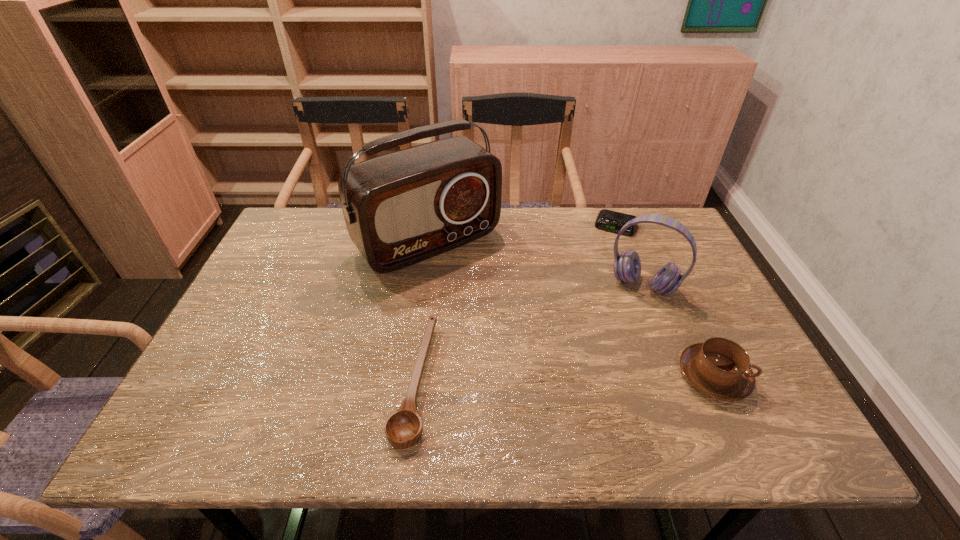
Choose which object is the second nearest neighbor to the second tallest object. Please provide its 2D coordinates. Your answer should be formatted as a tuple, i.e. [(x, y)], where the tuple contains the x and y coordinates of a point satisfying the conditions above.

[(719, 368)]

Where is `the closest object to the tallest object`? The image size is (960, 540). the closest object to the tallest object is located at coordinates (403, 428).

Identify the location of free space that satisfies the following two spatial constraints: 1. on the front side of the third tallest object; 2. on the side of the shortest object with the handle. The image size is (960, 540). (675, 376).

Image resolution: width=960 pixels, height=540 pixels. I want to click on vacant space that satisfies the following two spatial constraints: 1. on the front side of the cappuccino; 2. on the side of the tallest object with the handle, so click(x=410, y=376).